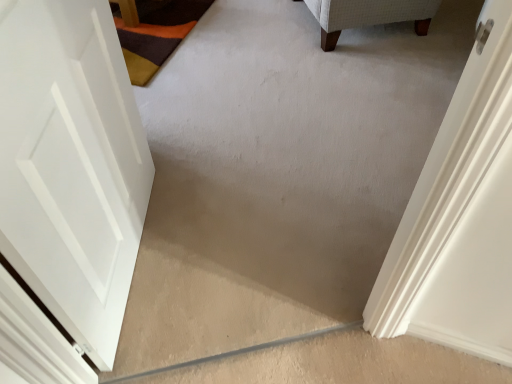
Describe the element at coordinates (155, 33) in the screenshot. I see `textured wool mat at upper left` at that location.

Find the location of `textured wool mat at upper left`. textured wool mat at upper left is located at coordinates (155, 33).

Identify the location of textured wool mat at upper left. This screenshot has height=384, width=512. (155, 33).